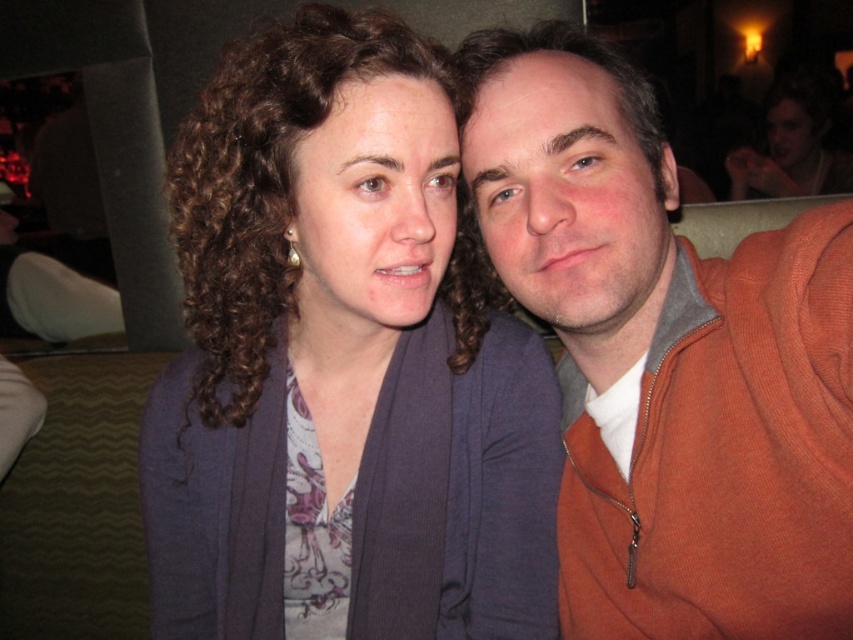
Does matte blue cardigan at center have a greater width compared to orange zip-up sweater at right?

Indeed, matte blue cardigan at center has a greater width compared to orange zip-up sweater at right.

Between matte blue cardigan at center and orange zip-up sweater at right, which one is positioned lower?

Positioned lower is matte blue cardigan at center.

Does point (413, 192) come farther from viewer compared to point (712, 360)?

No, it is not.

Identify the location of matte blue cardigan at center. (341, 360).